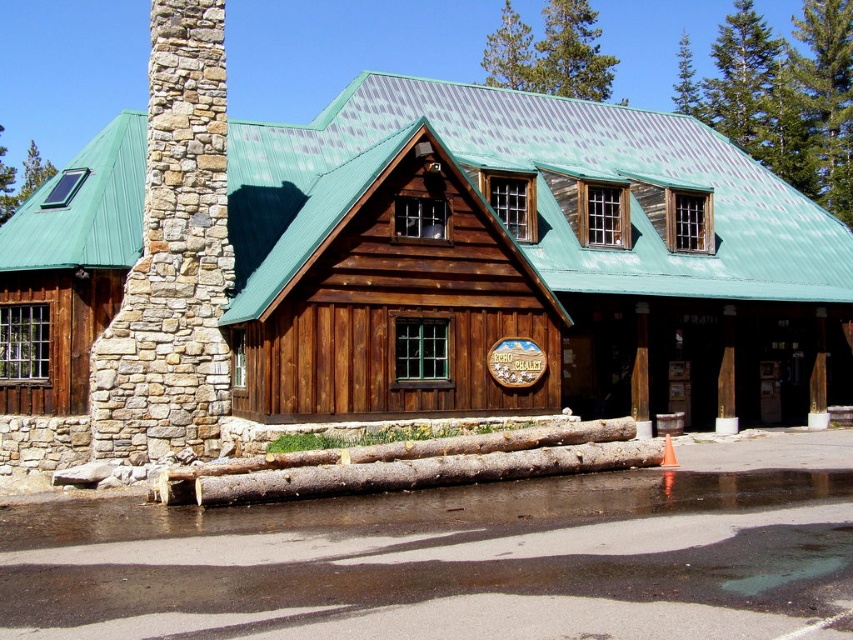
You are a delivery person trying to park your truck in front of the rustic wooden chalet. The truck requires a parking space of 25 feet. Is there enough space between the natural stone chimney at left and the smooth gray wood logs at center to park your truck?

The distance between the natural stone chimney at left and the smooth gray wood logs at center is 25.29 feet, which is slightly more than the required 25 feet. Therefore, there is enough space to park the truck between them.